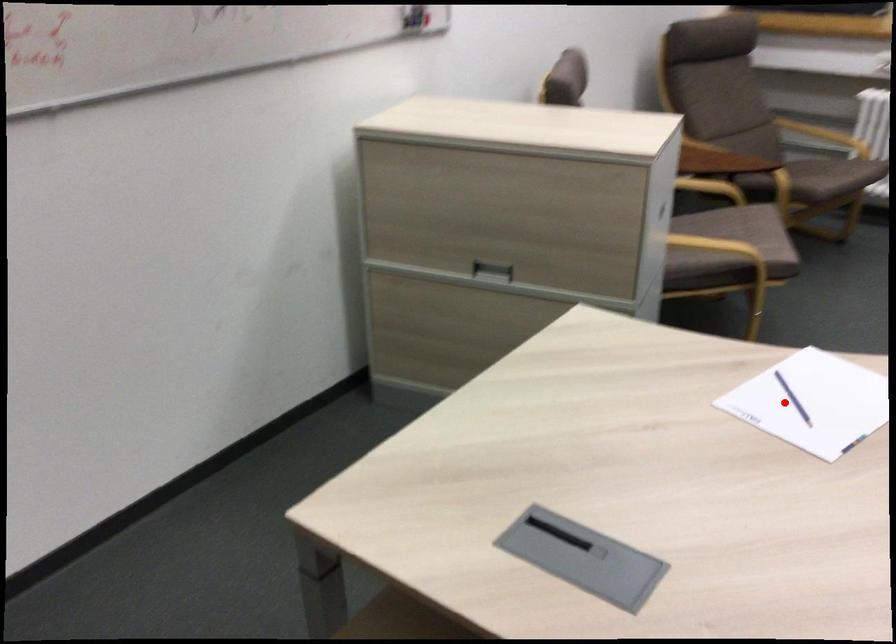
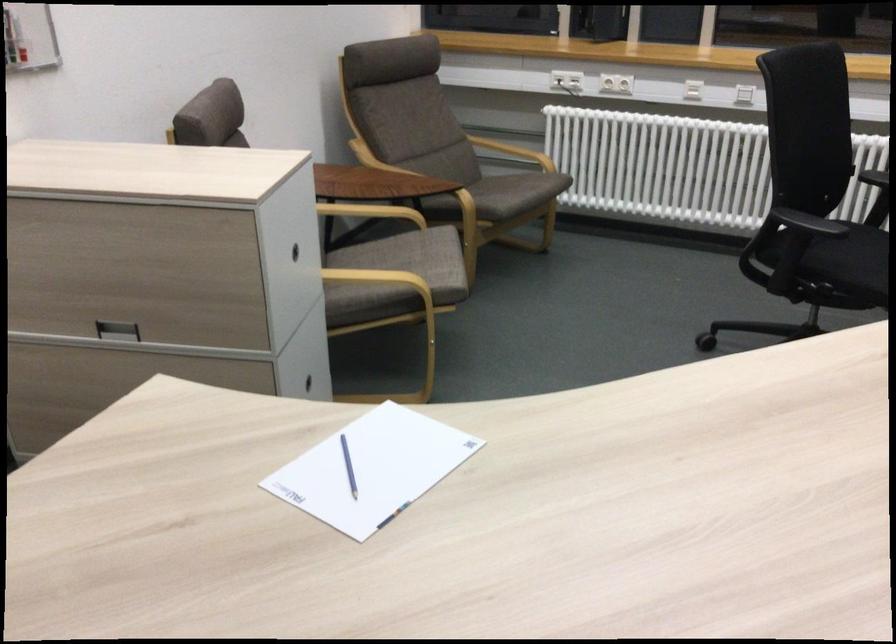
Where in the second image is the point corresponding to the highlighted location from the first image?

(348, 466)